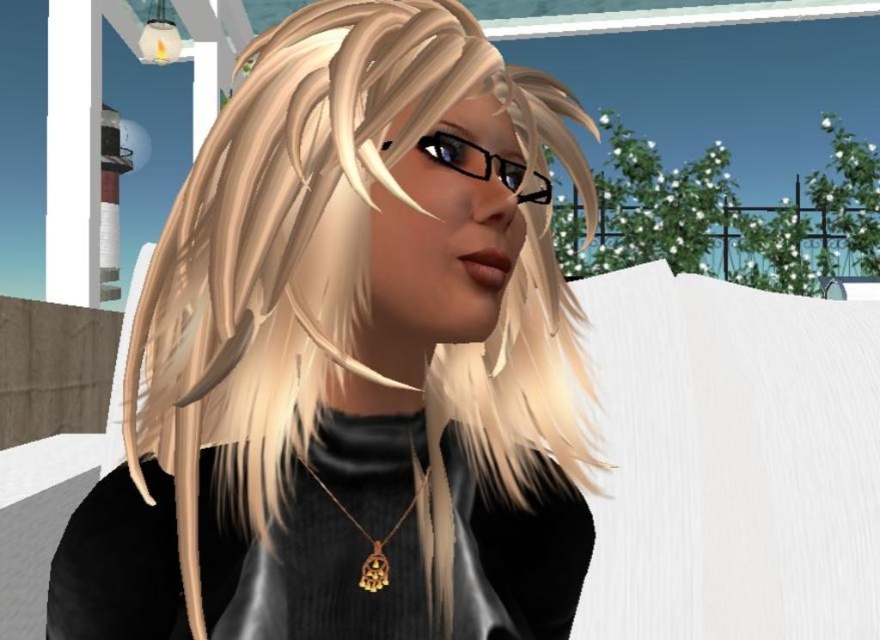
Who is more distant from viewer, (277, 433) or (502, 157)?

The point (502, 157) is behind.

Who is lower down, blonde silky hair at center or black plastic glasses at center?

blonde silky hair at center is lower down.

At what (x,y) coordinates should I click in order to perform the action: click on blonde silky hair at center. Please return your answer as a coordinate pair (x, y). The height and width of the screenshot is (640, 880). Looking at the image, I should click on (347, 282).

In the scene shown: Does black plastic glasses at center have a lesser width compared to gold metallic pendant at center?

Incorrect, black plastic glasses at center's width is not less than gold metallic pendant at center's.

Is black plastic glasses at center positioned in front of gold metallic pendant at center?

Yes.

At what (x,y) coordinates should I click in order to perform the action: click on black plastic glasses at center. Please return your answer as a coordinate pair (x, y). Looking at the image, I should click on (484, 164).

Who is positioned more to the right, blonde silky hair at center or gold metallic pendant at center?

gold metallic pendant at center is more to the right.

Who is more distant from viewer, [445,362] or [362,572]?

The point [445,362] is more distant.

Locate an element on the screen. blonde silky hair at center is located at coordinates (347, 282).